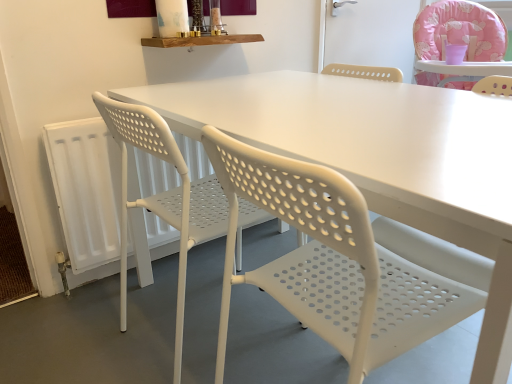
The image size is (512, 384). I want to click on vacant space underneath white perforated plastic chair at left, the third chair positioned from the right (from a real-world perspective), so click(214, 328).